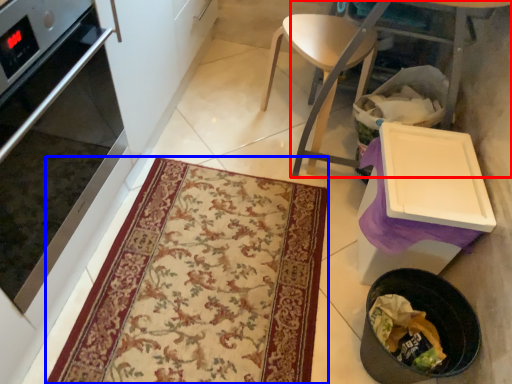
Question: Which of the following is the closest to the observer, table (highlighted by a red box) or mat (highlighted by a blue box)?

Choices:
 (A) table
 (B) mat

Answer: (A)